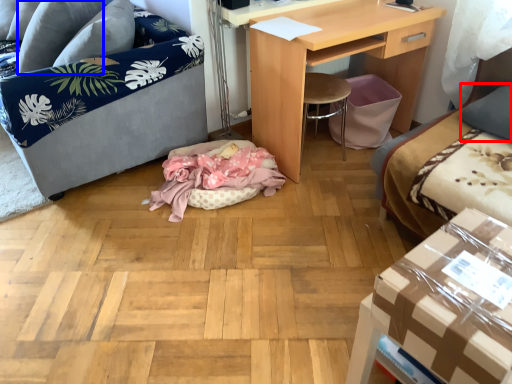
Question: Among these objects, which one is nearest to the camera, pillow (highlighted by a red box) or pillow (highlighted by a blue box)?

Choices:
 (A) pillow
 (B) pillow

Answer: (A)